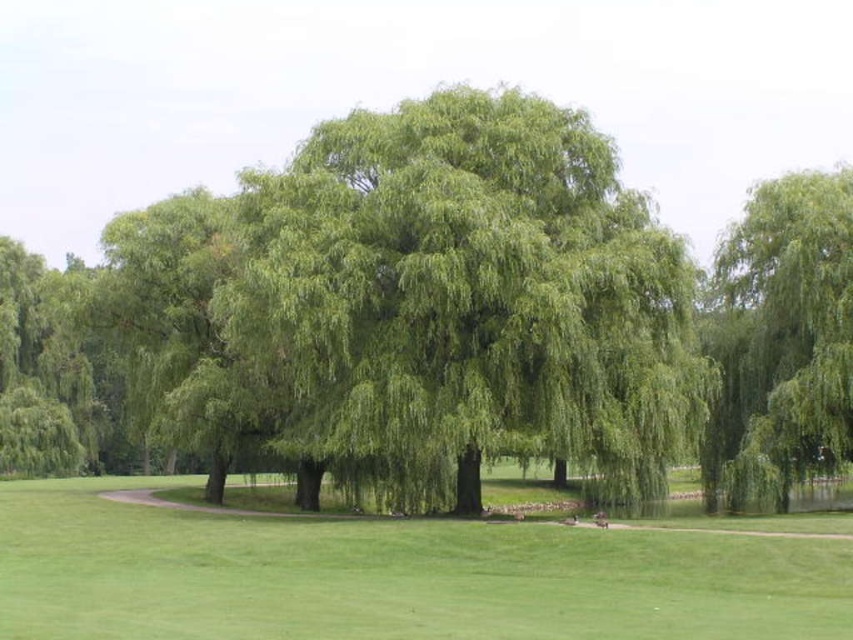
Question: Among these objects, which one is farthest from the camera?

Choices:
 (A) green leafy willow at center
 (B) green leafy willow at upper right

Answer: (B)

Question: Does green grass at center come in front of green leafy willow at upper right?

Choices:
 (A) no
 (B) yes

Answer: (B)

Question: Which point is closer to the camera taking this photo?

Choices:
 (A) (508, 577)
 (B) (827, 365)

Answer: (A)

Question: Which point appears farthest from the camera in this image?

Choices:
 (A) (572, 348)
 (B) (778, 417)
 (C) (10, 557)

Answer: (B)

Question: Is green grass at center positioned at the back of green leafy willow at upper right?

Choices:
 (A) yes
 (B) no

Answer: (B)

Question: Considering the relative positions of green leafy willow at center and green leafy willow at upper right in the image provided, where is green leafy willow at center located with respect to green leafy willow at upper right?

Choices:
 (A) below
 (B) above

Answer: (B)